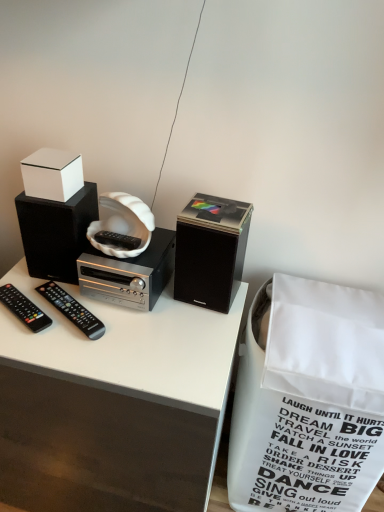
Question: Visually, is white matte cassette at center positioned to the left or to the right of white paper shopping bag at lower right?

Choices:
 (A) left
 (B) right

Answer: (A)

Question: Considering the positions of white matte cassette at center and white paper shopping bag at lower right in the image, is white matte cassette at center wider or thinner than white paper shopping bag at lower right?

Choices:
 (A) thin
 (B) wide

Answer: (A)

Question: Estimate the real-world distances between objects in this image. Which object is farther from the black plastic remote at left, which ranks as the 1th remote control in left-to-right order?

Choices:
 (A) white glossy box at upper left
 (B) black matte speaker at center, marked as the first speaker in a right-to-left arrangement
 (C) white matte cassette at center
 (D) black matte speaker at upper left, placed as the 1th speaker when sorted from left to right
 (E) black plastic remote at lower left, which is counted as the 2th remote control, starting from the left

Answer: (B)

Question: Which object is positioned farthest from the black matte speaker at upper left, placed as the 1th speaker when sorted from left to right?

Choices:
 (A) white matte cassette at center
 (B) black plastic remote at lower left, the 1th remote control viewed from the right
 (C) white paper shopping bag at lower right
 (D) black matte speaker at center, marked as the first speaker in a right-to-left arrangement
 (E) black plastic remote at left, marked as the second remote control in a right-to-left arrangement

Answer: (C)